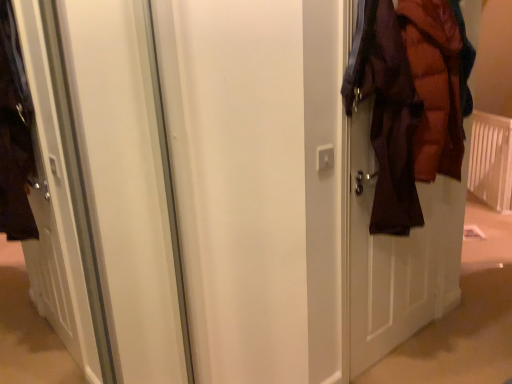
What do you see at coordinates (490, 160) in the screenshot?
I see `white plastic radiator at right` at bounding box center [490, 160].

I want to click on white plastic radiator at right, so click(x=490, y=160).

Consider the image. In order to face white plastic radiator at right, should I rotate leftwards or rightwards?

To align with it, rotate right about 28.353°.

This screenshot has height=384, width=512. In order to click on brown puffy jacket at right in this screenshot , I will do `click(435, 85)`.

The height and width of the screenshot is (384, 512). What do you see at coordinates (435, 85) in the screenshot?
I see `brown puffy jacket at right` at bounding box center [435, 85].

This screenshot has width=512, height=384. Find the location of `white plastic radiator at right`. white plastic radiator at right is located at coordinates (490, 160).

Consider the image. Which object is positioned more to the right, white plastic radiator at right or brown puffy jacket at right?

Positioned to the right is white plastic radiator at right.

In the image, is white plastic radiator at right positioned in front of or behind brown puffy jacket at right?

Clearly, white plastic radiator at right is behind brown puffy jacket at right.

Is point (490, 124) positioned after point (421, 10)?

Yes, point (490, 124) is behind point (421, 10).

From the image's perspective, is white plastic radiator at right on brown puffy jacket at right?

Yes.

From a real-world perspective, is white plastic radiator at right located beneath brown puffy jacket at right?

Yes.

In terms of width, does white plastic radiator at right look wider or thinner when compared to brown puffy jacket at right?

white plastic radiator at right is thinner than brown puffy jacket at right.

Considering the sizes of objects white plastic radiator at right and brown puffy jacket at right in the image provided, who is taller, white plastic radiator at right or brown puffy jacket at right?

With more height is white plastic radiator at right.

Which of these two, white plastic radiator at right or brown puffy jacket at right, is bigger?

Bigger between the two is white plastic radiator at right.

Can brown puffy jacket at right be found inside white plastic radiator at right?

Actually, brown puffy jacket at right is outside white plastic radiator at right.

Are white plastic radiator at right and brown puffy jacket at right located far from each other?

Yes, white plastic radiator at right and brown puffy jacket at right are located far from each other.

Consider the image. Is white plastic radiator at right looking in the opposite direction of brown puffy jacket at right?

That's not correct — white plastic radiator at right is not looking away from brown puffy jacket at right.

Can you tell me how much white plastic radiator at right and brown puffy jacket at right differ in facing direction?

The angular difference between white plastic radiator at right and brown puffy jacket at right is 135 degrees.

This screenshot has height=384, width=512. Identify the location of garment in front of the white plastic radiator at right. (435, 85).

Which is more to the left, brown puffy jacket at right or white plastic radiator at right?

brown puffy jacket at right.

Is brown puffy jacket at right in front of white plastic radiator at right?

Yes, it is.

Is point (441, 139) closer to camera compared to point (510, 132)?

Yes, point (441, 139) is closer to viewer.

From the image's perspective, is brown puffy jacket at right on white plastic radiator at right?

Actually, brown puffy jacket at right appears below white plastic radiator at right in the image.

From a real-world perspective, between brown puffy jacket at right and white plastic radiator at right, who is vertically higher?

brown puffy jacket at right is physically above.

Is brown puffy jacket at right wider or thinner than white plastic radiator at right?

brown puffy jacket at right is wider than white plastic radiator at right.

Does brown puffy jacket at right have a lesser height compared to white plastic radiator at right?

Indeed, brown puffy jacket at right has a lesser height compared to white plastic radiator at right.

Which of these two, brown puffy jacket at right or white plastic radiator at right, is bigger?

Bigger between the two is white plastic radiator at right.

Is brown puffy jacket at right spatially inside white plastic radiator at right, or outside of it?

brown puffy jacket at right is spatially situated outside white plastic radiator at right.

Looking at this image, is brown puffy jacket at right beside white plastic radiator at right?

No, brown puffy jacket at right is not beside white plastic radiator at right.

Could you tell me if brown puffy jacket at right is turned towards white plastic radiator at right?

No.

Can you tell me how much brown puffy jacket at right and white plastic radiator at right differ in facing direction?

135 degrees separate the facing orientations of brown puffy jacket at right and white plastic radiator at right.

At what (x,y) coordinates should I click in order to perform the action: click on garment on the left of white plastic radiator at right. Please return your answer as a coordinate pair (x, y). Looking at the image, I should click on (435, 85).

What are the coordinates of `radiator behind the brown puffy jacket at right` in the screenshot? It's located at (490, 160).

Find the location of a particular element. This screenshot has height=384, width=512. radiator beneath the brown puffy jacket at right (from a real-world perspective) is located at coordinates (490, 160).